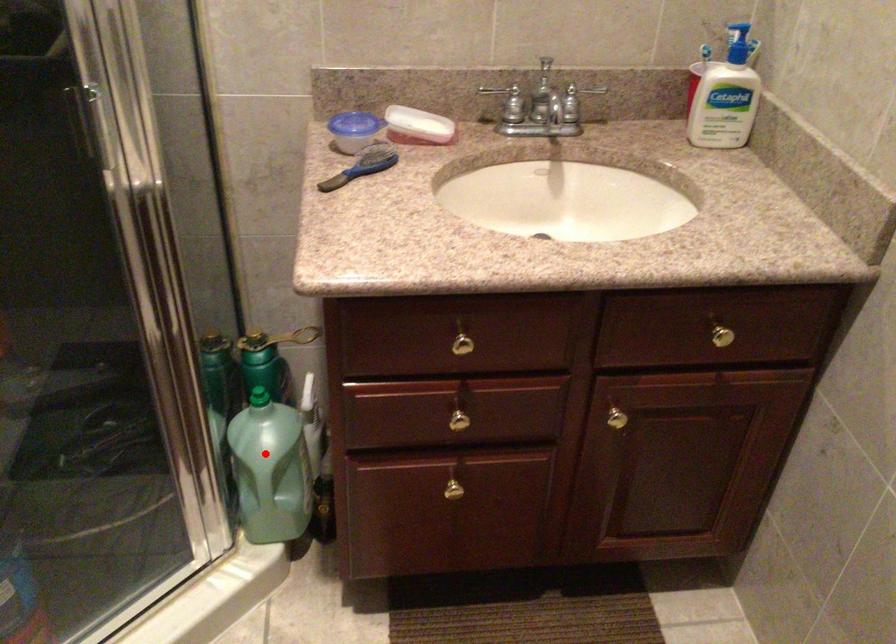
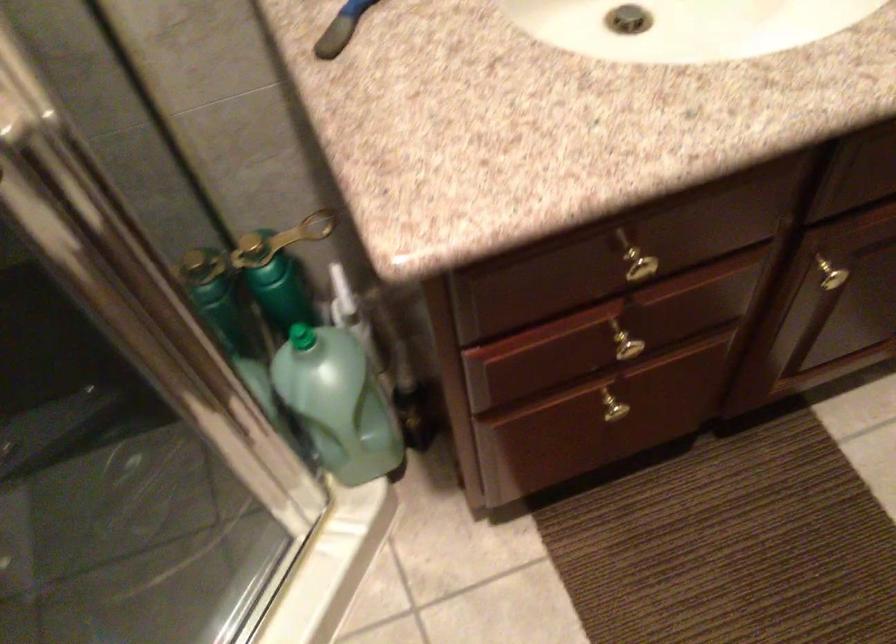
Question: I am providing you with two images of the same scene from different viewpoints. Image1 has a red point marked. In image2, the corresponding 3D location appears at what relative position? Reply with the corresponding letter.

Choices:
 (A) Closer
 (B) Farther

Answer: (A)